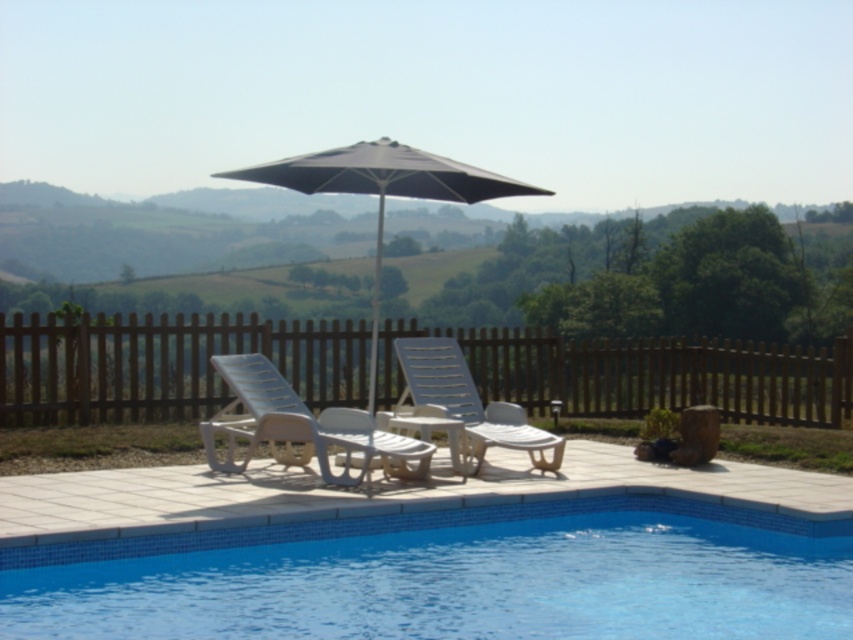
Between blue tile swimming pool at lower center and dark gray fabric umbrella at center, which one appears on the right side from the viewer's perspective?

blue tile swimming pool at lower center

Is point (746, 536) less distant than point (300, 182)?

Yes, it is in front of point (300, 182).

Find the location of a particular element. The height and width of the screenshot is (640, 853). blue tile swimming pool at lower center is located at coordinates (451, 576).

Is point (695, 400) more distant than point (314, 435)?

That is True.

Locate an element on the screen. This screenshot has height=640, width=853. brown wooden fence at center is located at coordinates (164, 364).

Which is below, brown wooden fence at center or dark gray fabric umbrella at center?

brown wooden fence at center is below.

Between brown wooden fence at center and dark gray fabric umbrella at center, which one has more height?

Standing taller between the two is dark gray fabric umbrella at center.

What do you see at coordinates (164, 364) in the screenshot?
I see `brown wooden fence at center` at bounding box center [164, 364].

The image size is (853, 640). What are the coordinates of `brown wooden fence at center` in the screenshot? It's located at (164, 364).